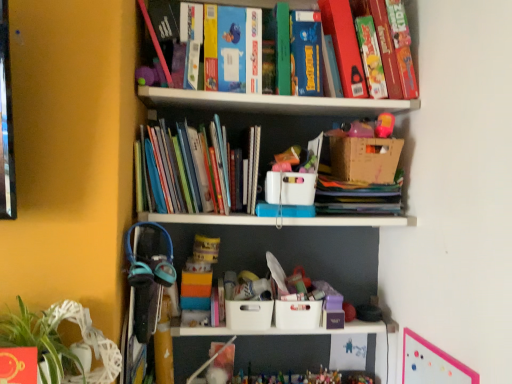
The height and width of the screenshot is (384, 512). What are the coordinates of `vacant space situated above matte pink toy at upper right (from a real-world perspective)` in the screenshot? It's located at click(x=366, y=107).